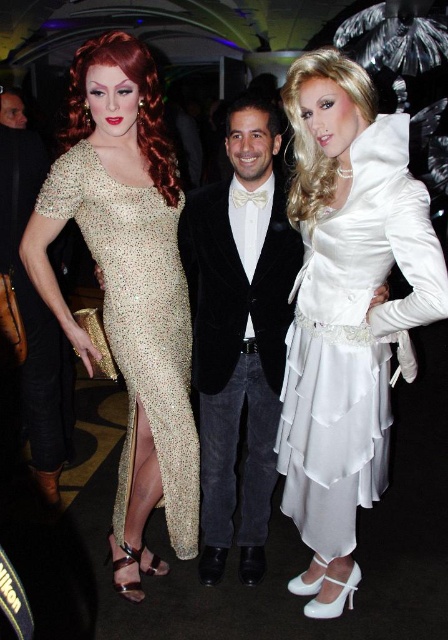
You are a photographer at the event and need to adjust the camera framing to ensure all three people are visible. Considering the white satin dress at right and the velvet black blazer at center, which one requires more horizontal space in the frame?

The white satin dress at right requires more horizontal space in the frame because its width is larger than the velvet black blazer at center.

In the image of the lively indoor event, there are two people wearing the white satin dress at right and the sparkly gold dress at left. Which one is positioned more to the right side of the scene?

The white satin dress at right is positioned more to the right side of the scene compared to the sparkly gold dress at left.

You are a photographer at this event and want to ensure both the white satin dress at right and the sparkly gold dress at left are in focus. Since you can only focus on one subject at a time, which dress should you prioritize focusing on to ensure the closest subject is sharp?

The white satin dress at right is closer to the viewer than the sparkly gold dress at left, so you should prioritize focusing on the white satin dress at right to ensure the closest subject is sharp.